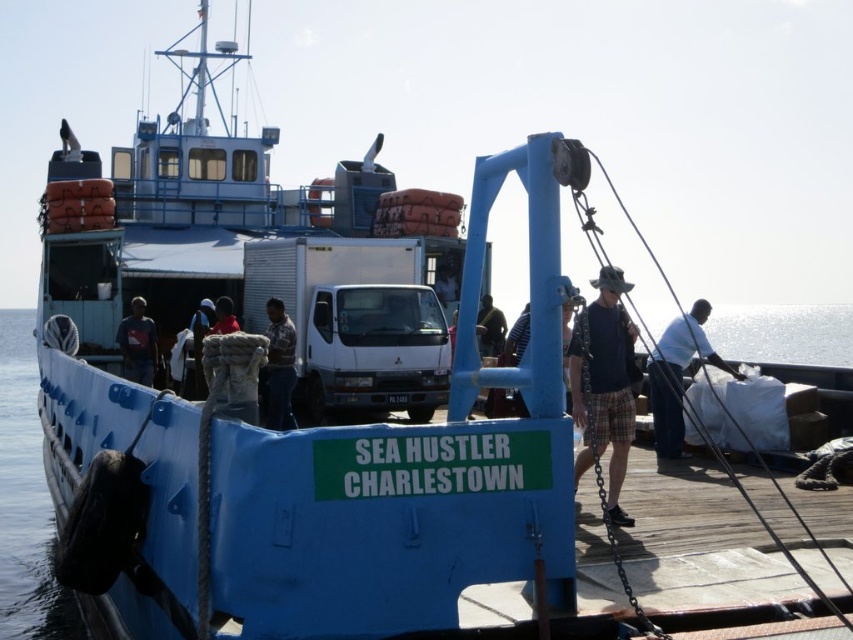
Does plaid shirt at center appear under green fabric shirt at center?

Yes, plaid shirt at center is below green fabric shirt at center.

Consider the image. Between plaid shirt at center and green fabric shirt at center, which one has more height?

plaid shirt at center is taller.

Is point (281, 346) positioned before point (489, 316)?

Yes, point (281, 346) is in front of point (489, 316).

The width and height of the screenshot is (853, 640). What are the coordinates of `plaid shirt at center` in the screenshot? It's located at (279, 368).

Is point (613, 516) closer to camera compared to point (141, 365)?

Yes.

Between point (590, 280) and point (138, 296), which one is positioned in front?

Point (590, 280) is in front.

Is point (572, 333) closer to camera compared to point (138, 356)?

Yes, point (572, 333) is in front of point (138, 356).

Where is `dark blue plaid shorts at center`? The image size is (853, 640). dark blue plaid shorts at center is located at coordinates (x=605, y=384).

Who is shorter, plaid shirt at center or light brown leather jacket at center?

Standing shorter between the two is light brown leather jacket at center.

Is plaid shirt at center positioned at the back of light brown leather jacket at center?

No, plaid shirt at center is closer to the viewer.

What do you see at coordinates (279, 368) in the screenshot? This screenshot has height=640, width=853. I see `plaid shirt at center` at bounding box center [279, 368].

You are a GUI agent. You are given a task and a screenshot of the screen. Output one action in this format:
    pyautogui.click(x=<x>, y=<y>)
    Task: Click on the plaid shirt at center
    This screenshot has width=853, height=640.
    Given the screenshot: What is the action you would take?
    279,368